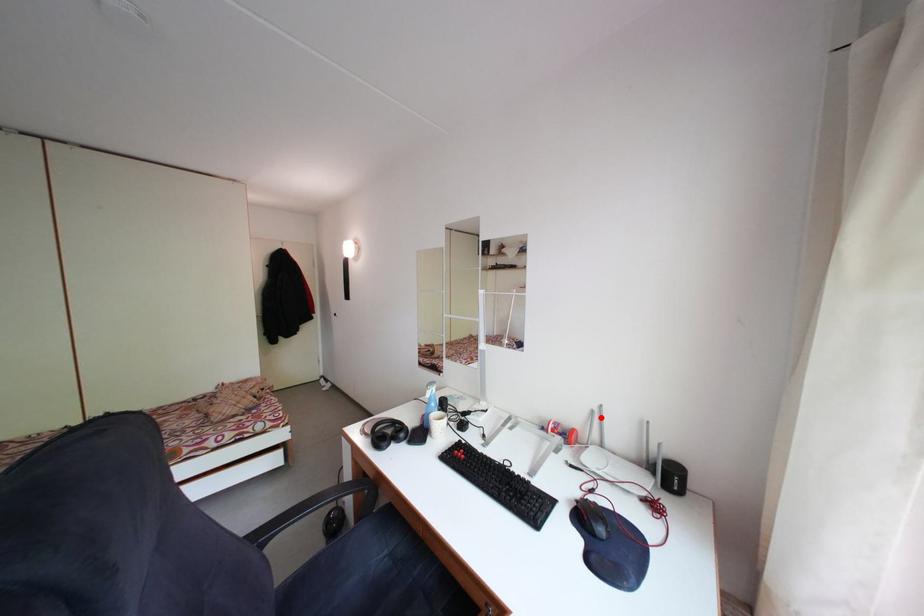
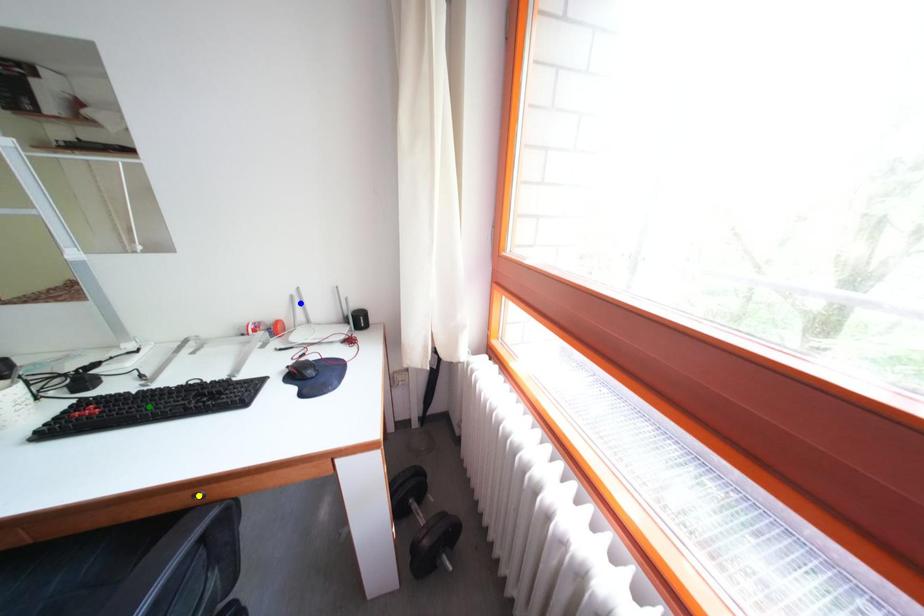
Question: I am providing you with two images of the same scene from different viewpoints. A red point is marked on the first image. You are given multiple points on the second image. Which point in image 2 represents the same 3d spot as the red point in image 1?

Choices:
 (A) green point
 (B) blue point
 (C) yellow point

Answer: (B)